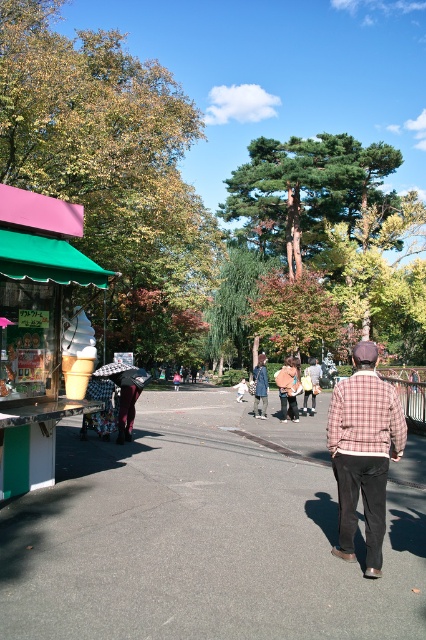
You are standing at the center of the park and see the fluffy beige coat at center. Where exactly is it located in terms of coordinates?

Answer: The fluffy beige coat at center is located at coordinates point (287, 387).

You are standing in the park and see the green leafy tree at upper left and the plaid fabric jacket at center. Which object is higher in the image?

The green leafy tree at upper left is positioned over the plaid fabric jacket at center, so it is higher.

You are trying to decide which coat to wear for a walk in the park. You have both the fluffy beige coat at center and the denim jacket at center. Based on their sizes, which one might be more comfortable for layering under a backpack?

The fluffy beige coat at center has a lesser width compared to the denim jacket at center, so the denim jacket at center might be more comfortable for layering under a backpack as it allows more space.